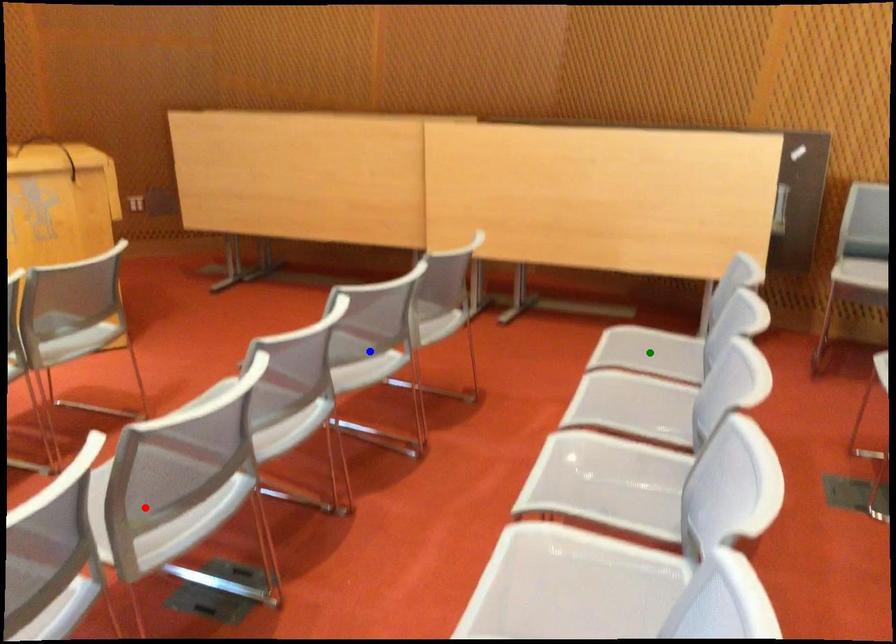
Order these from farthest to nearest:
1. blue point
2. red point
3. green point

green point < blue point < red point